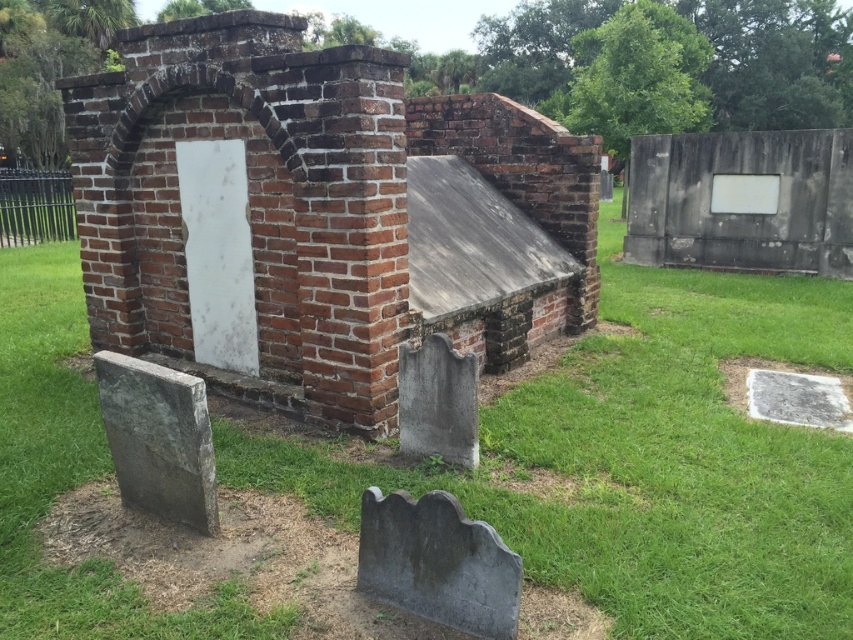
Question: Which point is farther to the camera?

Choices:
 (A) (431, 522)
 (B) (105, 426)
 (C) (424, 429)

Answer: (C)

Question: Considering the real-world distances, which object is farthest from the gray stone gravestone at lower center?

Choices:
 (A) gray stone gravestone at lower left
 (B) green grass at center
 (C) gray stone gravestone at center

Answer: (B)

Question: Is green grass at center below gray stone gravestone at lower center?

Choices:
 (A) no
 (B) yes

Answer: (A)

Question: Which point is farther to the camera?

Choices:
 (A) gray stone gravestone at center
 (B) green grass at center
 (C) gray stone gravestone at lower center

Answer: (A)

Question: Does green grass at center appear on the left side of gray stone gravestone at lower center?

Choices:
 (A) no
 (B) yes

Answer: (B)

Question: Does green grass at center appear on the right side of gray stone gravestone at center?

Choices:
 (A) yes
 (B) no

Answer: (B)